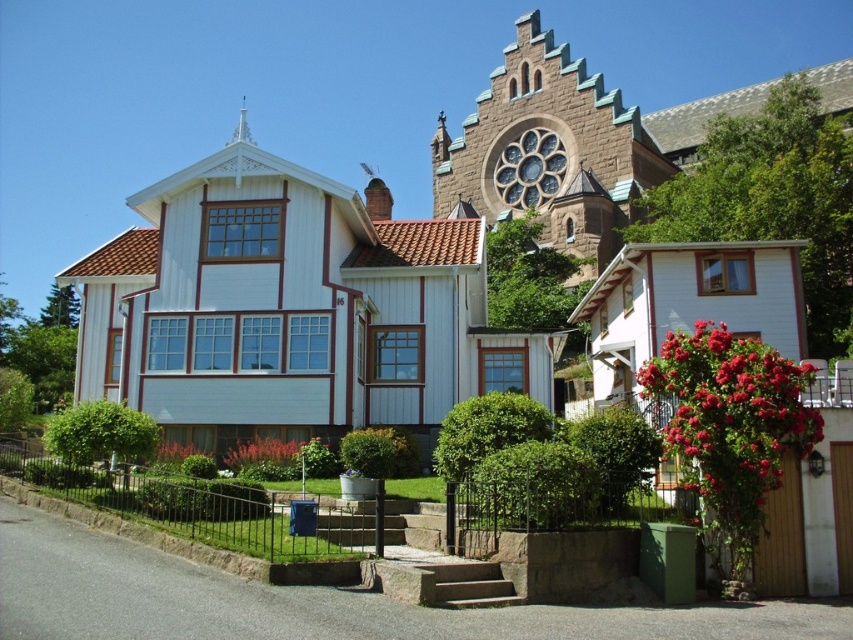
You are planning to deliver a package to the white wood house at center and the brown stone chapel at upper center. Since the delivery van is quite large, you need to know which destination is bigger to ensure the van can fit. Based on the scene, which one is larger?

The white wood house at center has a larger size compared to the brown stone chapel at upper center, so the van should fit better at the white wood house at center.